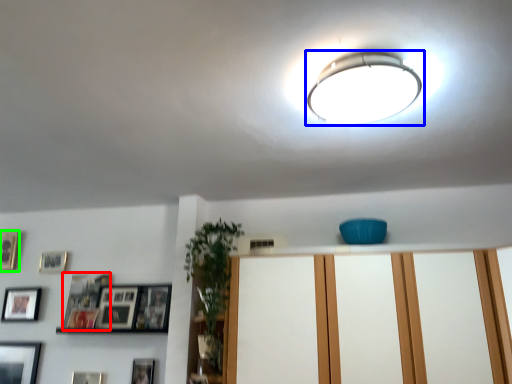
Question: Which object is the closest to the picture frame (highlighted by a red box)? Choose among these: lamp (highlighted by a blue box) or picture frame (highlighted by a green box).

Choices:
 (A) lamp
 (B) picture frame

Answer: (B)